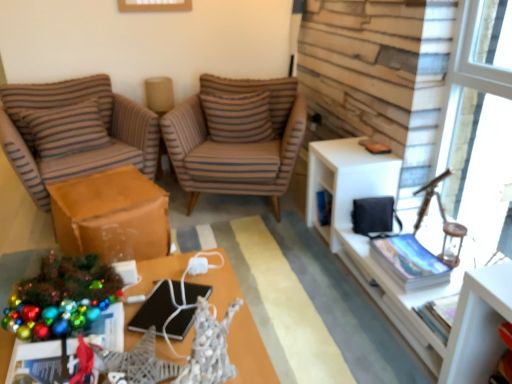
Locate an element on the screen. The width and height of the screenshot is (512, 384). vacant space to the right of brown paper bag at lower left is located at coordinates (213, 236).